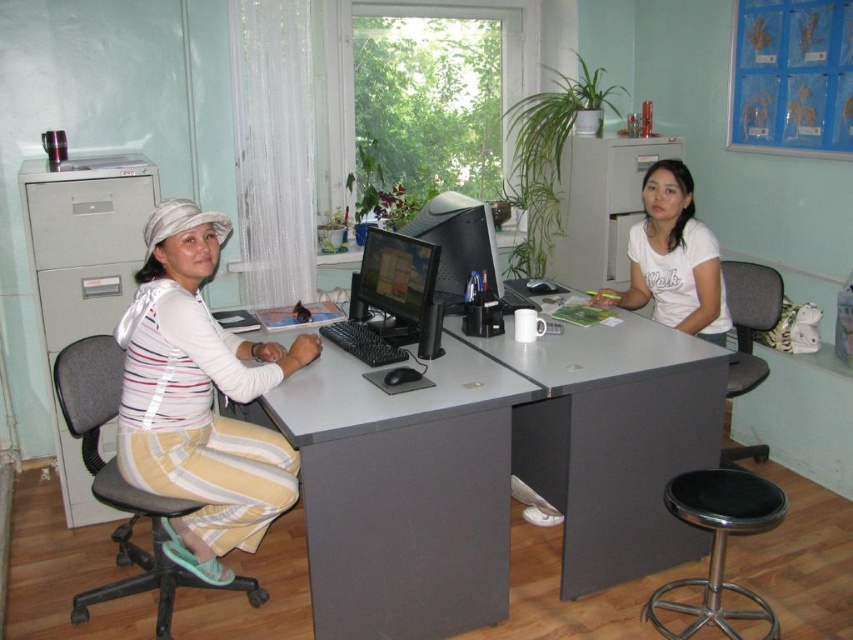
Is gray matte computer desk at center positioned behind black fabric swivel chair at left?

No, it is in front of black fabric swivel chair at left.

Is gray matte computer desk at center to the right of black fabric swivel chair at left from the viewer's perspective?

Indeed, gray matte computer desk at center is positioned on the right side of black fabric swivel chair at left.

I want to click on gray matte computer desk at center, so click(497, 472).

Measure the distance from gray matte computer desk at center to gray metallic file cabinet at left.

They are 4.58 feet apart.

Who is more forward, (434, 561) or (76, 296)?

Point (434, 561)

Measure the distance between gray matte computer desk at center and camera.

gray matte computer desk at center is 1.93 meters from camera.

Identify the location of gray matte computer desk at center. The width and height of the screenshot is (853, 640). (497, 472).

Can you confirm if gray matte computer desk at center is thinner than striped cotton shirt at left?

Incorrect, gray matte computer desk at center's width is not less than striped cotton shirt at left's.

Between gray matte computer desk at center and striped cotton shirt at left, which one is positioned higher?

Positioned higher is striped cotton shirt at left.

Image resolution: width=853 pixels, height=640 pixels. Describe the element at coordinates (497, 472) in the screenshot. I see `gray matte computer desk at center` at that location.

You are a GUI agent. You are given a task and a screenshot of the screen. Output one action in this format:
    pyautogui.click(x=<x>, y=<y>)
    Task: Click on the gray matte computer desk at center
    Image resolution: width=853 pixels, height=640 pixels.
    Given the screenshot: What is the action you would take?
    pyautogui.click(x=497, y=472)